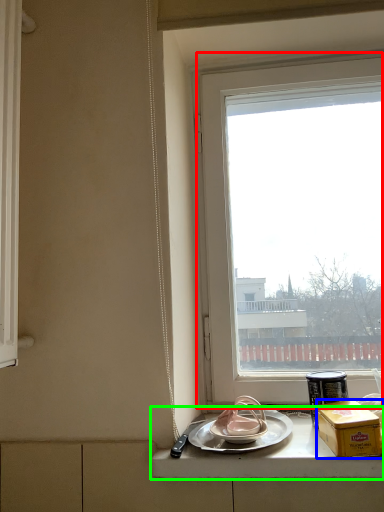
Question: Which object is positioned closest to window (highlighted by a red box)? Select from box (highlighted by a blue box) and counter top (highlighted by a green box).

Choices:
 (A) box
 (B) counter top

Answer: (B)